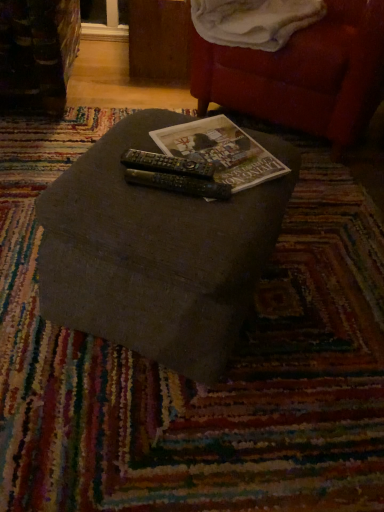
Identify the location of vacant area that lies in front of black plastic remote at center, the 2th remote viewed from the front. (x=170, y=214).